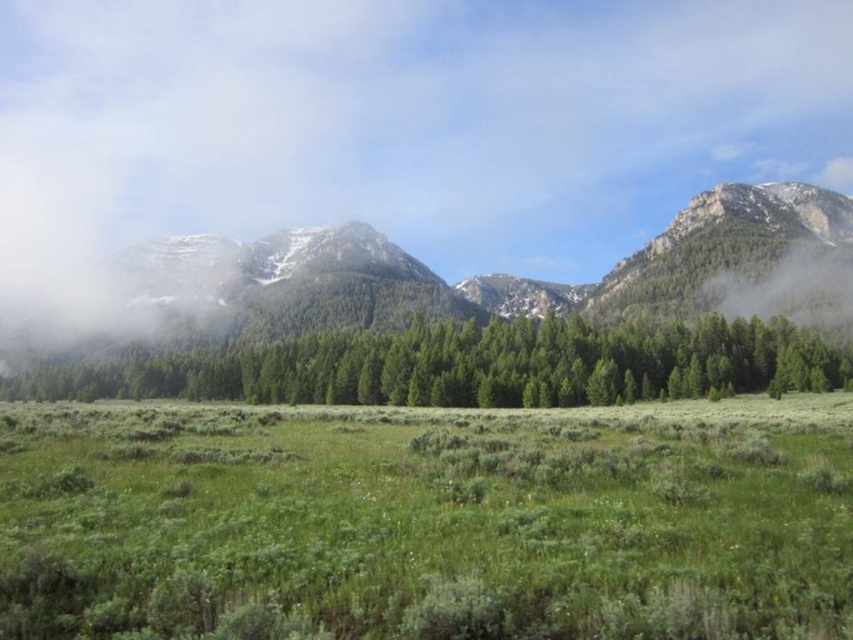
You are standing in the meadow and want to reach the mountains beyond the forest. Based on the image, which direction should you head towards from the green soft grass at center to reach the green matte forest at center first?

The green soft grass at center is located below the green matte forest at center. To reach the forest first, you should head upwards from the green soft grass at center towards the green matte forest at center.

You are standing in the meadow and see a point marked at coordinates (399,125). According to the image, what is this point located on?

The point at (399,125) is located on the white fluffy cloud at upper center.